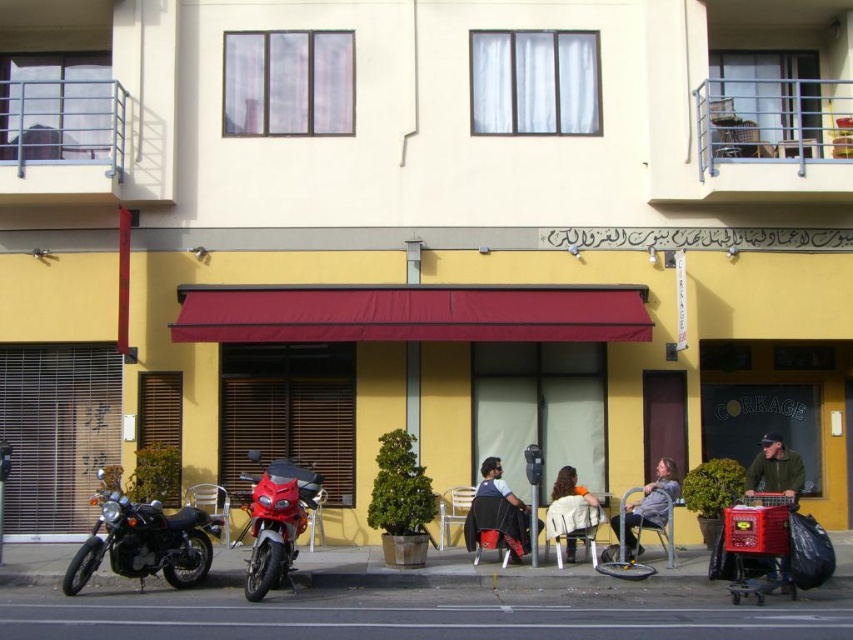
Does green fabric jacket at lower right have a smaller size compared to gray fabric jacket at lower right?

Yes, green fabric jacket at lower right is smaller than gray fabric jacket at lower right.

Locate an element on the screen. The height and width of the screenshot is (640, 853). green fabric jacket at lower right is located at coordinates (775, 470).

Who is more forward, (x=753, y=490) or (x=628, y=525)?

Point (x=753, y=490) is more forward.

You are a GUI agent. You are given a task and a screenshot of the screen. Output one action in this format:
    pyautogui.click(x=<x>, y=<y>)
    Task: Click on the green fabric jacket at lower right
    
    Given the screenshot: What is the action you would take?
    pyautogui.click(x=775, y=470)

Is point (583, 506) farther from viewer compared to point (641, 496)?

No, (583, 506) is in front of (641, 496).

Locate an element on the screen. The width and height of the screenshot is (853, 640). light brown leather jacket at center is located at coordinates (570, 509).

At what (x,y) coordinates should I click in order to perform the action: click on light brown leather jacket at center. Please return your answer as a coordinate pair (x, y). The image size is (853, 640). Looking at the image, I should click on (570, 509).

Between black matte motorcycle at lower left and shiny red motorcycle at lower left, which one appears on the right side from the viewer's perspective?

Positioned to the right is shiny red motorcycle at lower left.

Is point (109, 508) more distant than point (270, 497)?

Yes, it is.

Find the location of a particular element. The width and height of the screenshot is (853, 640). black matte motorcycle at lower left is located at coordinates (143, 540).